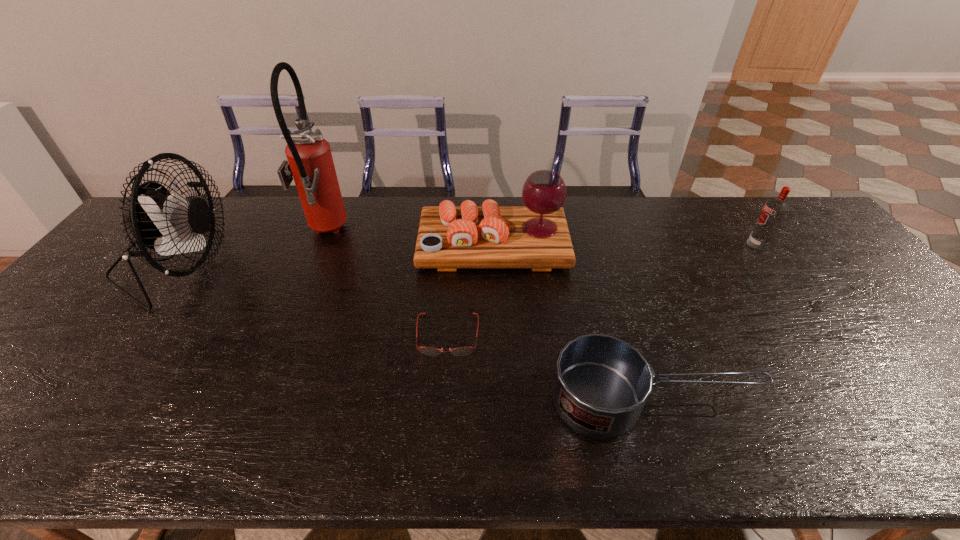
At what (x,y) coordinates should I click in order to perform the action: click on the tallest object. Please return your answer as a coordinate pair (x, y). This screenshot has height=540, width=960. Looking at the image, I should click on (310, 163).

At what (x,y) coordinates should I click in order to perform the action: click on the second object from left to right. Please return your answer as a coordinate pair (x, y). The height and width of the screenshot is (540, 960). Looking at the image, I should click on (310, 163).

The width and height of the screenshot is (960, 540). What are the coordinates of `fan` in the screenshot? It's located at (158, 220).

The image size is (960, 540). Find the location of `the second tallest object`. the second tallest object is located at coordinates (158, 220).

The width and height of the screenshot is (960, 540). Identify the location of platter. (536, 236).

This screenshot has height=540, width=960. I want to click on vodka, so click(774, 211).

The width and height of the screenshot is (960, 540). What are the coordinates of `the fifth tallest object` in the screenshot? It's located at (601, 384).

Where is `saucepan`? This screenshot has height=540, width=960. saucepan is located at coordinates (601, 384).

You are a GUI agent. You are given a task and a screenshot of the screen. Output one action in this format:
    pyautogui.click(x=<x>, y=<y>)
    Task: Click on the spectacles
    Image resolution: width=960 pixels, height=540 pixels.
    Given the screenshot: What is the action you would take?
    pyautogui.click(x=460, y=351)

The image size is (960, 540). I want to click on vacant area situated 0.390m at the nozzle of the fire extinguisher, so click(468, 233).